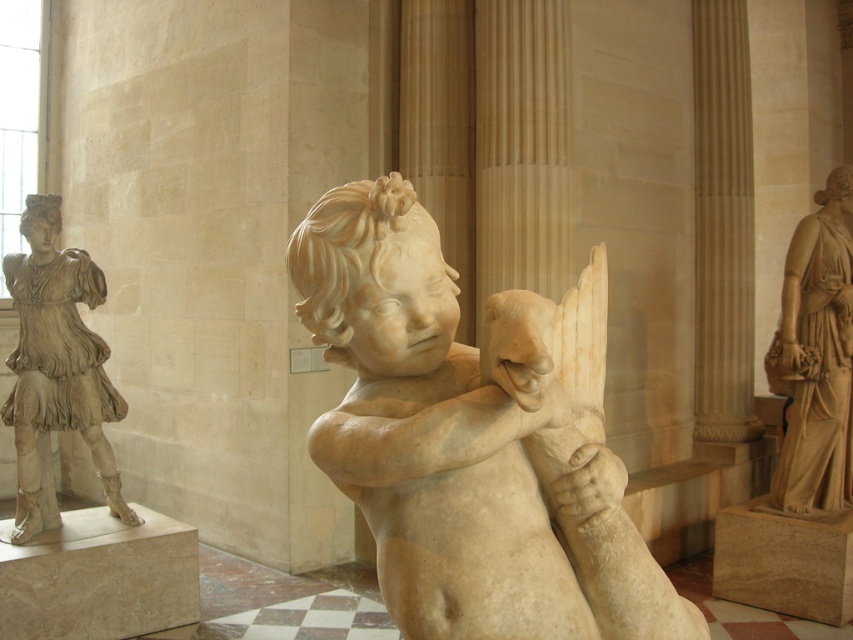
Question: Is matte beige statue at left positioned behind marble statue at right?

Choices:
 (A) no
 (B) yes

Answer: (A)

Question: Can you confirm if white marble cherub at center is positioned below marble statue at right?

Choices:
 (A) no
 (B) yes

Answer: (B)

Question: Which of these objects is positioned closest to the marble statue at right?

Choices:
 (A) white marble cherub at center
 (B) matte beige statue at left

Answer: (B)

Question: Which point is closer to the camera taking this photo?

Choices:
 (A) (846, 429)
 (B) (28, 308)
 (C) (412, 477)

Answer: (C)

Question: Which object is positioned closest to the matte beige statue at left?

Choices:
 (A) marble statue at right
 (B) white marble cherub at center

Answer: (B)

Question: Can you confirm if white marble cherub at center is positioned above matte beige statue at left?

Choices:
 (A) yes
 (B) no

Answer: (B)